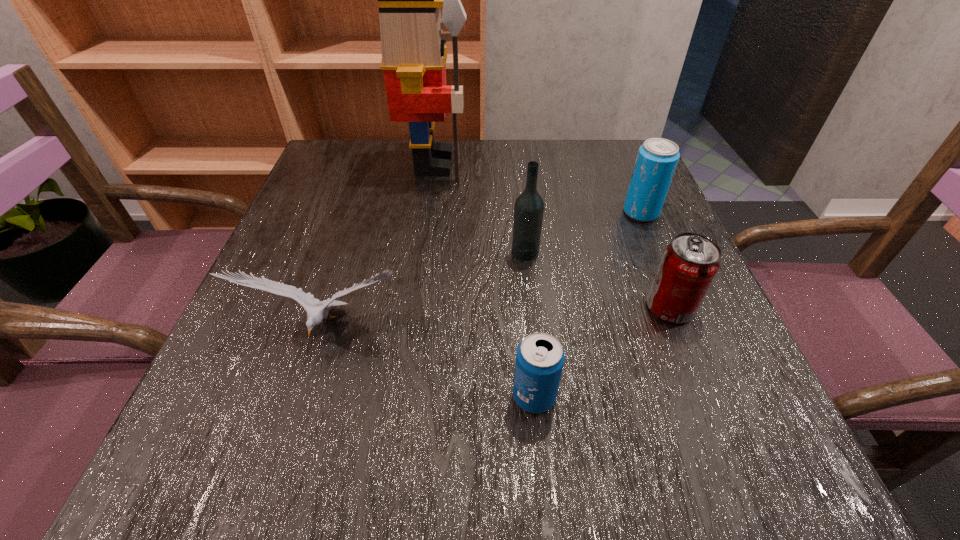
I want to click on the tallest object, so click(x=414, y=56).

Identify the location of nutcracker. The width and height of the screenshot is (960, 540). (414, 56).

Locate an element on the screen. the fourth nearest object is located at coordinates (529, 206).

Locate an element on the screen. The height and width of the screenshot is (540, 960). vodka is located at coordinates (529, 206).

You are a GUI agent. You are given a task and a screenshot of the screen. Output one action in this format:
    pyautogui.click(x=<x>, y=<y>)
    Task: Click on the farthest soda can
    
    Given the screenshot: What is the action you would take?
    pyautogui.click(x=657, y=158)

This screenshot has width=960, height=540. I want to click on gull, so click(x=317, y=310).

Identify the location of the second farthest soda can. This screenshot has width=960, height=540. [x=689, y=264].

At what (x,y) coordinates should I click in order to perform the action: click on the leftmost soda can. Please return your answer as a coordinate pair (x, y). Looking at the image, I should click on (540, 358).

Where is `the shortest object`? The width and height of the screenshot is (960, 540). the shortest object is located at coordinates (540, 358).

This screenshot has width=960, height=540. I want to click on free point located in front of the farthest object holding the staff, so click(x=537, y=164).